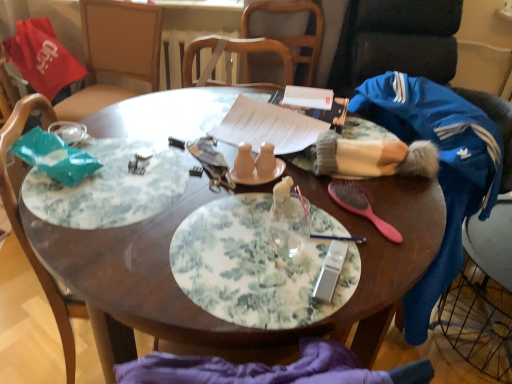
Locate an element on the screen. This screenshot has height=384, width=512. free space to the left of metallic silver pen at center, which appears as the fourth tableware when viewed from the left is located at coordinates (263, 235).